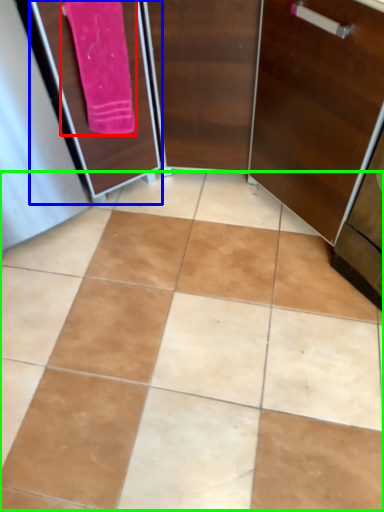
Question: Which object is the farthest from bath towel (highlighted by a red box)? Choose among these: screen door (highlighted by a blue box) or ceramic tile (highlighted by a green box).

Choices:
 (A) screen door
 (B) ceramic tile

Answer: (B)